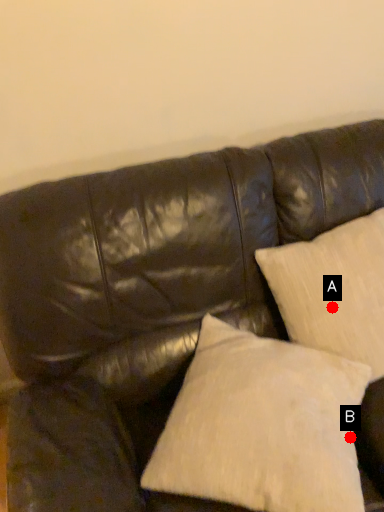
Question: Two points are circled on the image, labeled by A and B beside each circle. Which point is closer to the camera?

Choices:
 (A) A is closer
 (B) B is closer

Answer: (B)